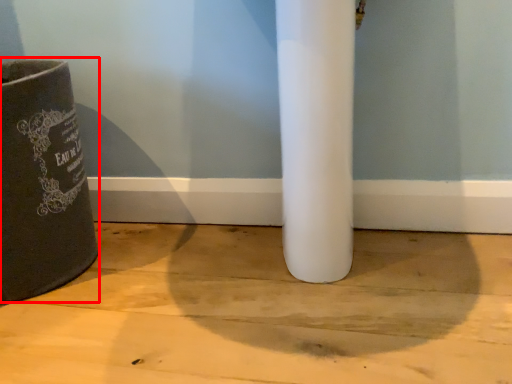
Question: From the image's perspective, where is waste container (annotated by the red box) located in relation to concrete in the image?

Choices:
 (A) above
 (B) below

Answer: (A)